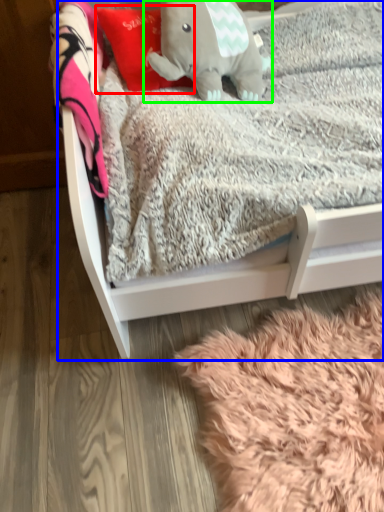
Question: Which is nearer to the throw pillow (highlighted by a red box)? infant bed (highlighted by a blue box) or elephant (highlighted by a green box).

Choices:
 (A) infant bed
 (B) elephant

Answer: (B)